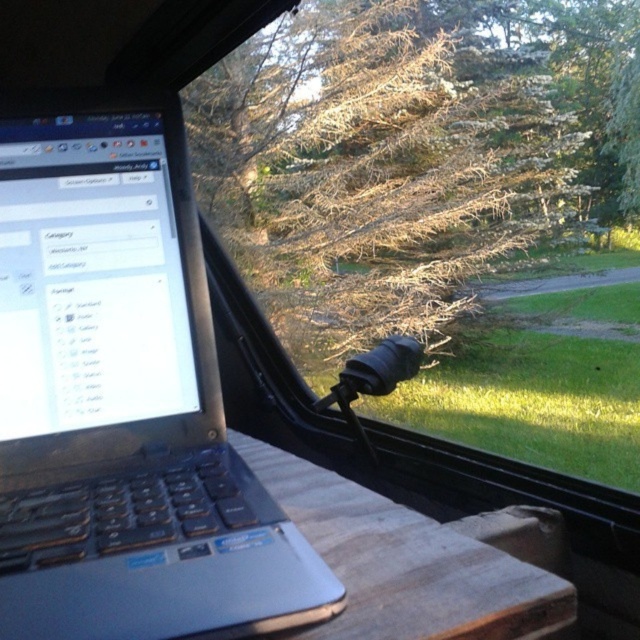
Question: Can you confirm if slate gray plastic laptop at left is positioned below brown/dried wood tree at upper center?

Choices:
 (A) yes
 (B) no

Answer: (A)

Question: Which point is farther to the camera?

Choices:
 (A) (92, 339)
 (B) (298, 144)

Answer: (B)

Question: Does slate gray plastic laptop at left appear under brown/dried wood tree at upper center?

Choices:
 (A) no
 (B) yes

Answer: (B)

Question: Which of the following is the farthest from the observer?

Choices:
 (A) (22, 260)
 (B) (308, 340)

Answer: (B)

Question: Is slate gray plastic laptop at left to the right of brown/dried wood tree at upper center from the viewer's perspective?

Choices:
 (A) no
 (B) yes

Answer: (A)